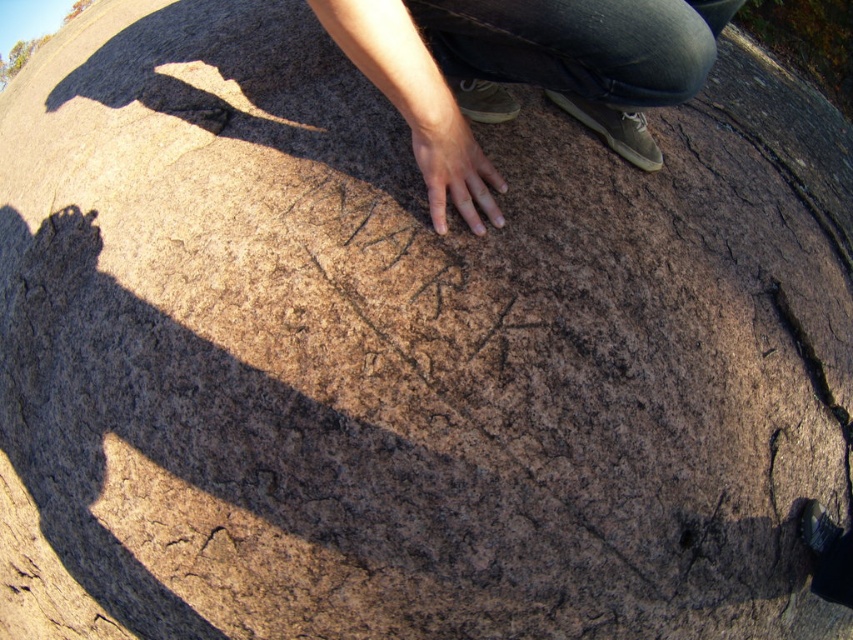
You are an archaeologist examining the rock with runic inscriptions. You notice two areas of interest on the rock surface. One is the smooth tan skin at center, and the other is the smooth brown hand at center. Based on their positions, which area is higher up on the rock?

The smooth tan skin at center is taller than the smooth brown hand at center, so the smooth tan skin at center is higher up on the rock.

You are an archaeologist examining the rock with runic inscriptions. You notice two areas with smooth surfaces on the rock. One is labeled as smooth tan skin at center and the other as smooth brown hand at center. Based on their positions, which smooth area is located to the left?

The smooth brown hand at center is located to the left of the smooth tan skin at center.